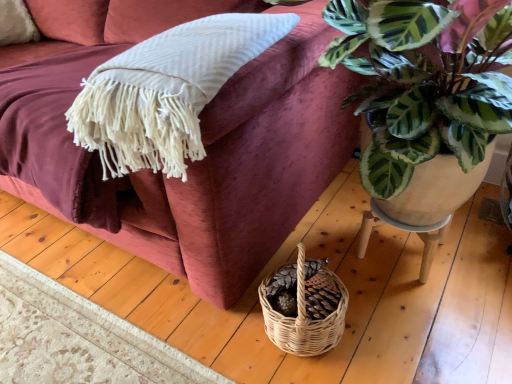
Question: Should I look upward or downward to see velvet maroon couch at upper left?

Choices:
 (A) up
 (B) down

Answer: (A)

Question: Is velvet maroon couch at upper left smaller than wooden stool at lower right?

Choices:
 (A) yes
 (B) no

Answer: (B)

Question: Considering the relative sizes of velvet maroon couch at upper left and wooden stool at lower right in the image provided, is velvet maroon couch at upper left shorter than wooden stool at lower right?

Choices:
 (A) yes
 (B) no

Answer: (B)

Question: From a real-world perspective, is velvet maroon couch at upper left on top of wooden stool at lower right?

Choices:
 (A) yes
 (B) no

Answer: (A)

Question: Would you say velvet maroon couch at upper left is outside wooden stool at lower right?

Choices:
 (A) yes
 (B) no

Answer: (A)

Question: Could you tell me if velvet maroon couch at upper left is facing wooden stool at lower right?

Choices:
 (A) yes
 (B) no

Answer: (B)

Question: Can wooden stool at lower right be found inside velvet maroon couch at upper left?

Choices:
 (A) yes
 (B) no

Answer: (B)

Question: Can you confirm if wooden stool at lower right is taller than velvet maroon couch at upper left?

Choices:
 (A) yes
 (B) no

Answer: (B)

Question: Is wooden stool at lower right facing towards velvet maroon couch at upper left?

Choices:
 (A) yes
 (B) no

Answer: (B)

Question: From the image's perspective, would you say wooden stool at lower right is shown under velvet maroon couch at upper left?

Choices:
 (A) no
 (B) yes

Answer: (B)

Question: Does wooden stool at lower right appear on the left side of velvet maroon couch at upper left?

Choices:
 (A) no
 (B) yes

Answer: (A)

Question: Is wooden stool at lower right thinner than velvet maroon couch at upper left?

Choices:
 (A) no
 (B) yes

Answer: (B)

Question: Is wooden stool at lower right next to velvet maroon couch at upper left and touching it?

Choices:
 (A) yes
 (B) no

Answer: (B)

Question: From a real-world perspective, relative to velvet maroon couch at upper left, is wooden stool at lower right vertically above or below?

Choices:
 (A) below
 (B) above

Answer: (A)